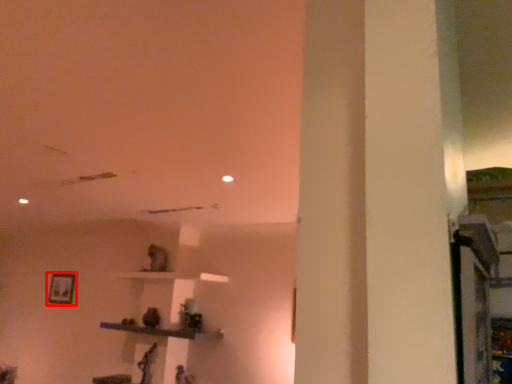
Question: From the image, what is the correct spatial relationship of picture frame (annotated by the red box) in relation to furniture?

Choices:
 (A) right
 (B) left

Answer: (B)